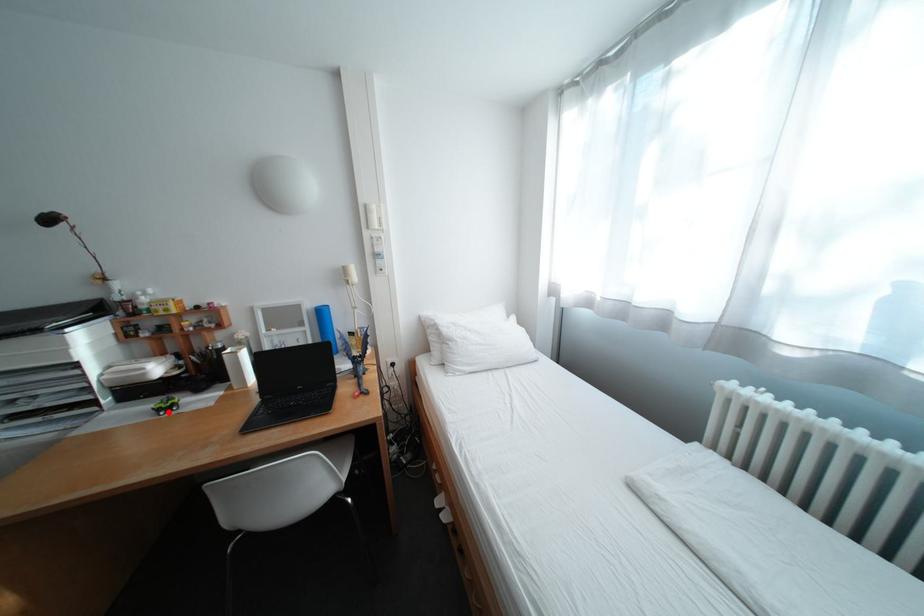
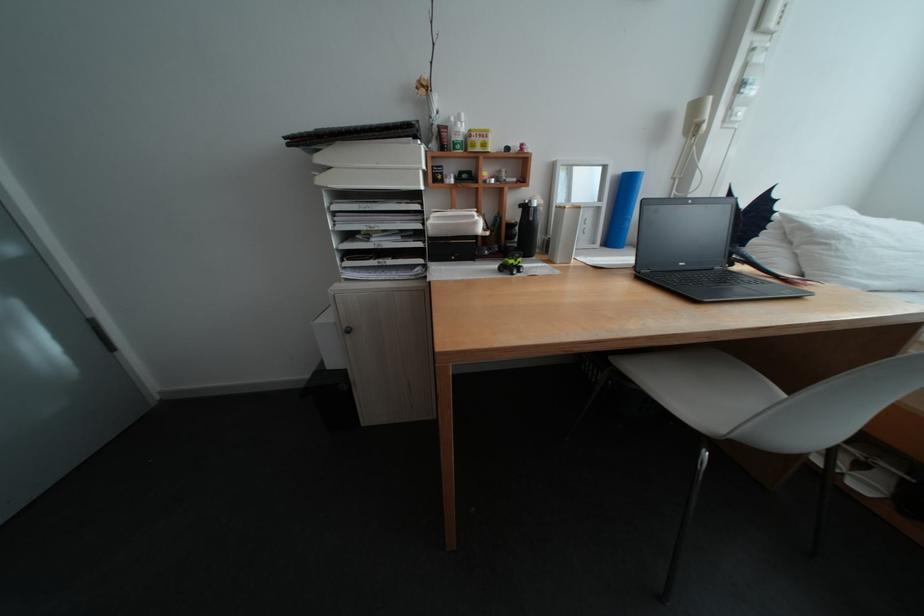
Locate, in the second image, the point that corresponds to the highlighted location in the first image.

(511, 272)